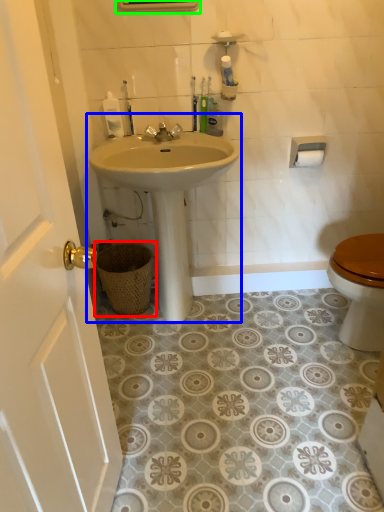
Question: Which object is positioned closest to basket (highlighted by a red box)? Select from sink (highlighted by a blue box) and medicine cabinet (highlighted by a green box).

Choices:
 (A) sink
 (B) medicine cabinet

Answer: (A)